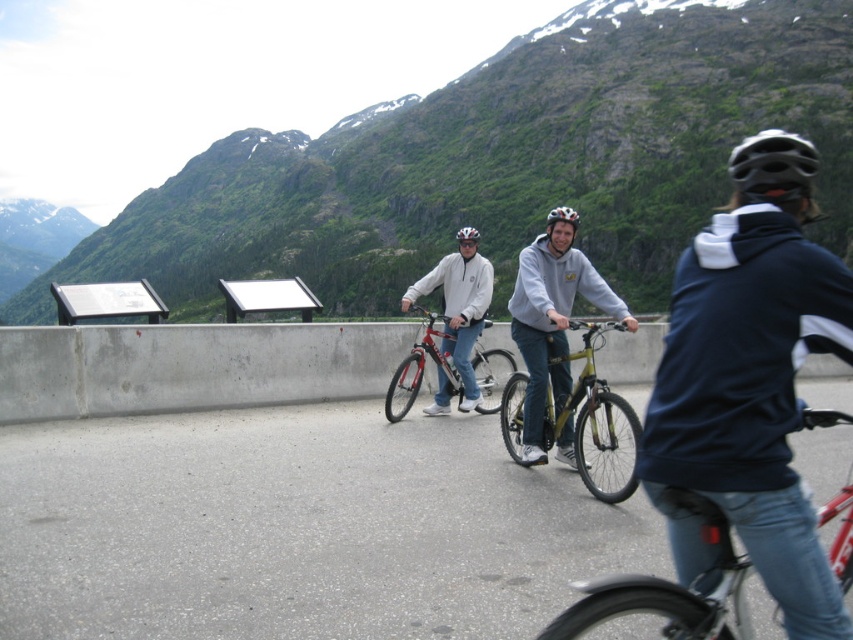
You are a photographer trying to capture a clear shot of the dark blue hoodie at right and the shiny black helmet at upper right. Which object should you focus on if you want the taller one to be in sharp focus?

The shiny black helmet at upper right is taller than the dark blue hoodie at right, so you should focus on the shiny black helmet at upper right to ensure it is in sharp focus.

You are a photographer positioned at the origin point. You want to take a photo of the matte gray hoodie at center. Which direction should you move to get a better shot?

The matte gray hoodie at center is located at point (x=550, y=323), so you should move towards the coordinates to frame it properly.

You are a photographer trying to capture a photo of the matte gray hoodie at center and the shiny metallic bicycle at center. Based on their positions, which object should you adjust your camera to focus on first if you want to ensure both are in the frame?

The matte gray hoodie at center is to the right of the shiny metallic bicycle at center, so you should focus on the shiny metallic bicycle at center first to ensure both are in the frame.